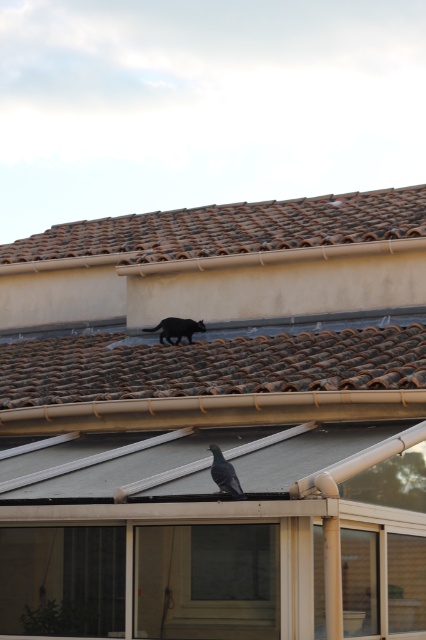
Question: Does brown clay tiles at upper center have a greater width compared to shiny blue pigeon at center?

Choices:
 (A) yes
 (B) no

Answer: (A)

Question: Based on their relative distances, which object is farther from the brown tile roof at center?

Choices:
 (A) black fur cat at upper center
 (B) brown clay tiles at upper center
 (C) shiny blue pigeon at center

Answer: (C)

Question: Can you confirm if brown tile roof at center is positioned to the left of black fur cat at upper center?

Choices:
 (A) no
 (B) yes

Answer: (B)

Question: Which point is closer to the camera?

Choices:
 (A) (218, 483)
 (B) (195, 381)
 (C) (316, 230)
 (D) (187, 336)

Answer: (A)

Question: Which point is farther to the camera?

Choices:
 (A) (388, 360)
 (B) (222, 467)
 (C) (181, 221)

Answer: (C)

Question: Where is brown clay tiles at upper center located in relation to shiny blue pigeon at center in the image?

Choices:
 (A) below
 (B) above

Answer: (B)